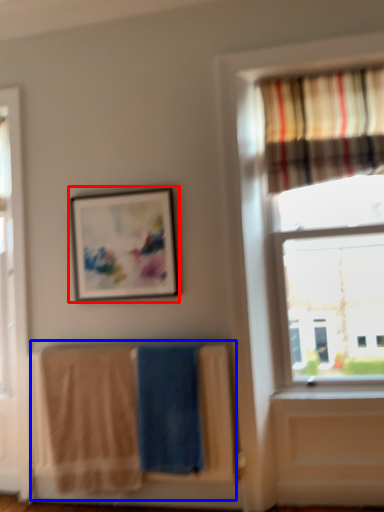
Question: Which point is further to the camera, picture frame (highlighted by a red box) or laundry (highlighted by a blue box)?

Choices:
 (A) picture frame
 (B) laundry

Answer: (A)